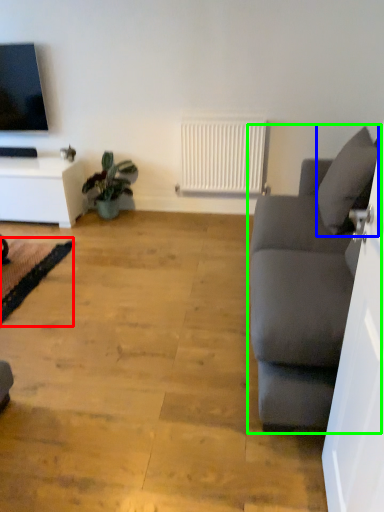
Question: Which is farther away from yoga mat (highlighted by a red box)? pillow (highlighted by a blue box) or studio couch (highlighted by a green box)?

Choices:
 (A) pillow
 (B) studio couch

Answer: (A)